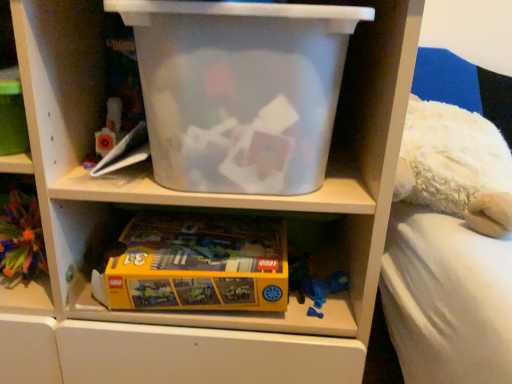
Where is `blank space situated above yellow cardboard lego box at lower center (from a real-world perspective)`? blank space situated above yellow cardboard lego box at lower center (from a real-world perspective) is located at coordinates (211, 233).